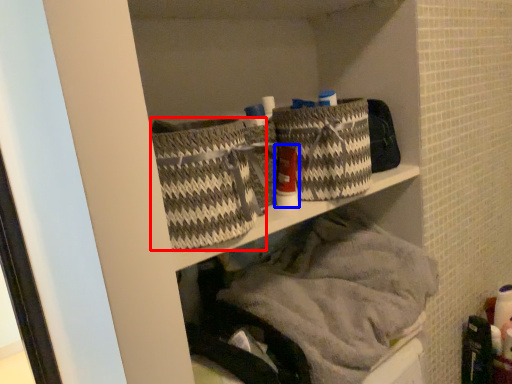
Question: Which of the following is the farthest to the observer, basket (highlighted by a red box) or toiletry (highlighted by a blue box)?

Choices:
 (A) basket
 (B) toiletry

Answer: (B)